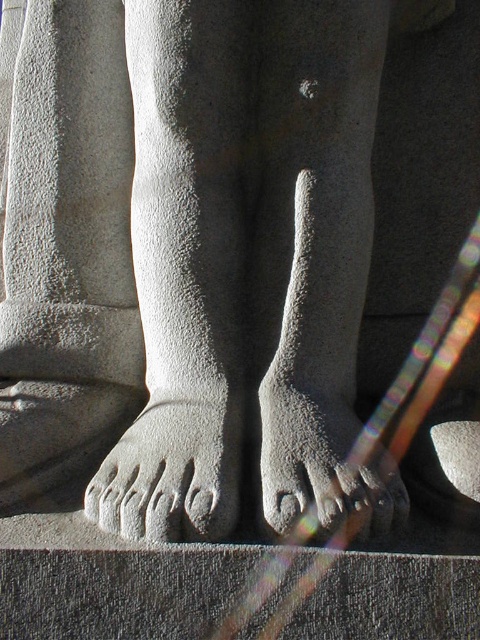
Question: Which point appears closest to the camera in this image?

Choices:
 (A) (238, 404)
 (B) (269, 442)

Answer: (B)

Question: Which object appears farthest from the camera in this image?

Choices:
 (A) gray stone foot at center
 (B) gray stone foot at lower center

Answer: (A)

Question: Where is gray stone foot at lower center located in relation to gray stone foot at center in the image?

Choices:
 (A) left
 (B) right

Answer: (A)

Question: Which point appears farthest from the camera in this image?

Choices:
 (A) (189, 497)
 (B) (312, 458)

Answer: (B)

Question: Is gray stone foot at lower center bigger than gray stone foot at center?

Choices:
 (A) no
 (B) yes

Answer: (B)

Question: Does gray stone foot at lower center come behind gray stone foot at center?

Choices:
 (A) no
 (B) yes

Answer: (A)